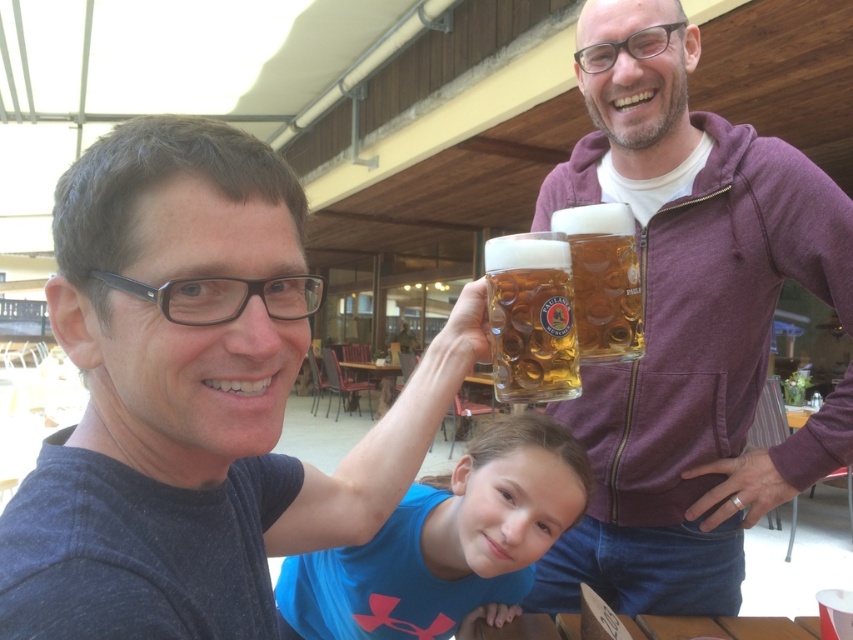
Is golden glass mug at upper center to the right of translucent glass mug at upper center from the viewer's perspective?

No, golden glass mug at upper center is not to the right of translucent glass mug at upper center.

Find the location of a particular element. golden glass mug at upper center is located at coordinates (531, 317).

What do you see at coordinates (193, 397) in the screenshot? This screenshot has width=853, height=640. I see `matte black shirt at upper left` at bounding box center [193, 397].

Can you confirm if matte black shirt at upper left is thinner than matte purple hoodie at upper right?

Correct, matte black shirt at upper left's width is less than matte purple hoodie at upper right's.

Between point (271, 540) and point (788, 176), which one is positioned in front?

Point (271, 540)

Where is `matte black shirt at upper left`? matte black shirt at upper left is located at coordinates (193, 397).

Can you confirm if matte black shirt at upper left is bigger than translucent glass mug at upper center?

Yes.

Between point (74, 192) and point (616, 212), which one is positioned behind?

Positioned behind is point (616, 212).

This screenshot has width=853, height=640. What are the coordinates of `matte black shirt at upper left` in the screenshot? It's located at (193, 397).